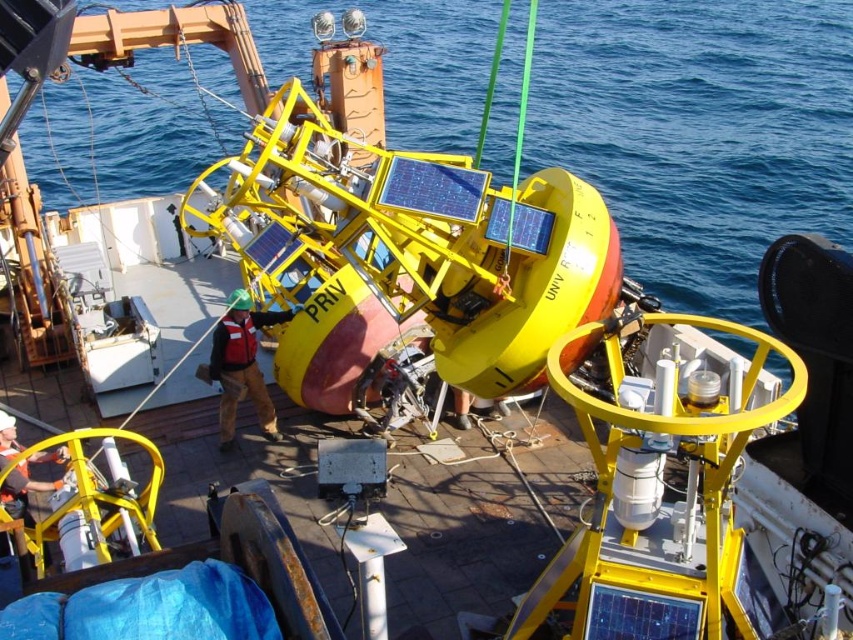
You are standing on the ship deck and want to move from the point at coordinates point (212,362) to the point at coordinates point (15,429). Can you walk directly between them without any obstacles?

Point (212,362) is in front of point (15,429), so there is an obstacle blocking the direct path between them. You cannot walk directly between them without encountering an obstruction.

You are a safety inspector on the ship and need to ensure that all helmets are placed correctly according to regulations. According to the scene, where is the hard hat helmet at center in relation to the brushed metal helmet at lower left?

The hard hat helmet at center is to the right of the brushed metal helmet at lower left.